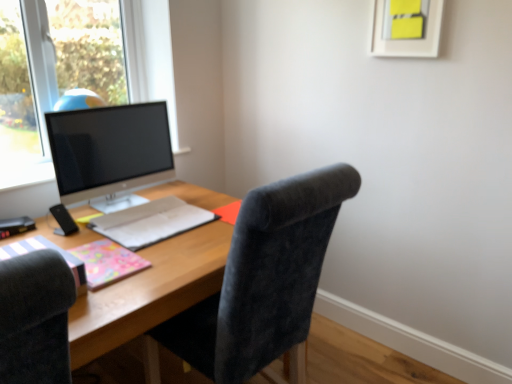
At what (x,y) coordinates should I click in order to perform the action: click on vacant space in front of pink glossy notebook at lower left, marked as the second notebook in a front-to-back arrangement. Please return your answer as a coordinate pair (x, y). Looking at the image, I should click on (110, 299).